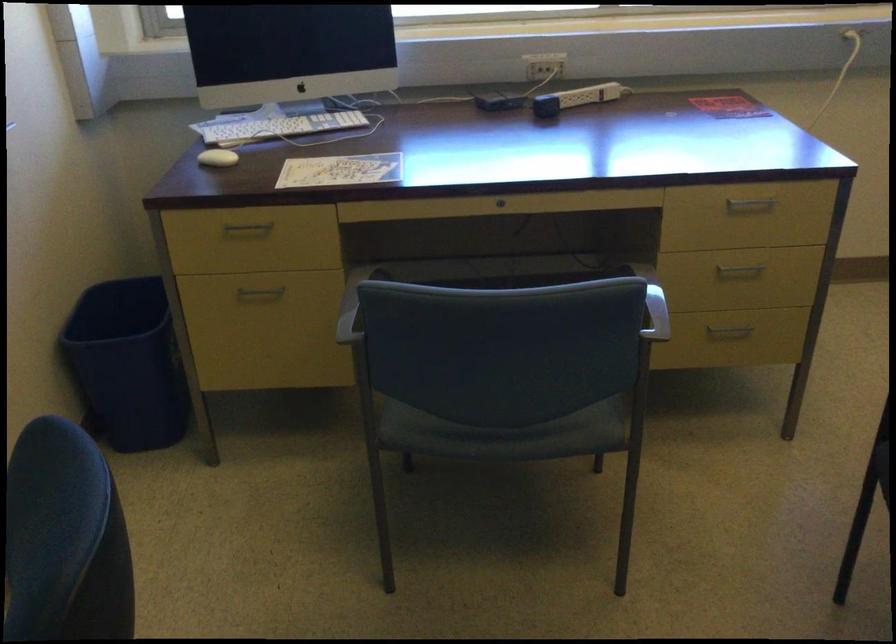
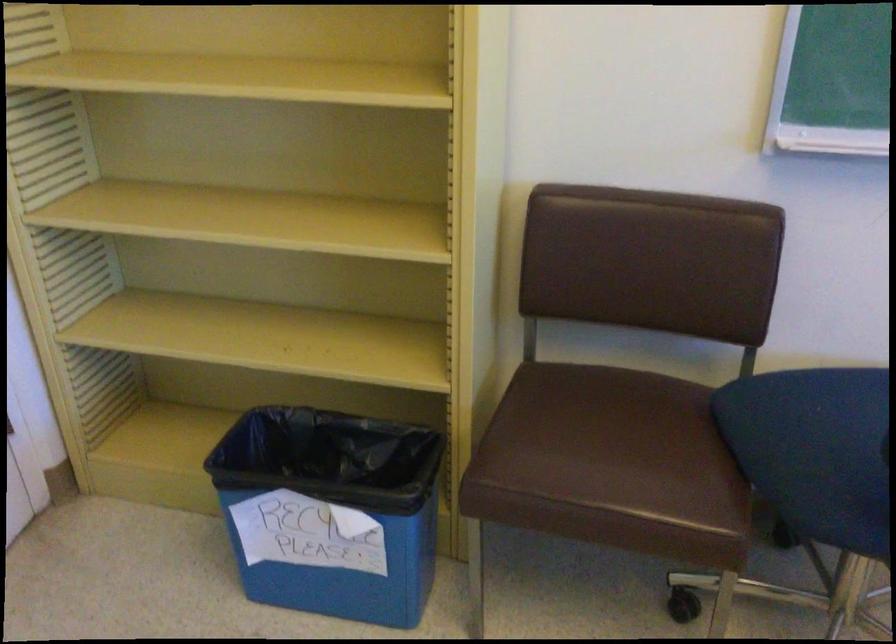
How did the camera likely rotate?

The camera's rotation is toward left-down.